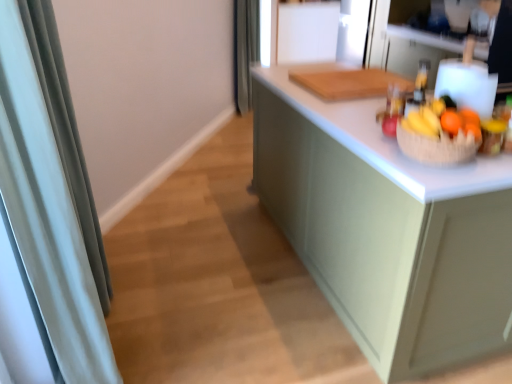
What do you see at coordinates (443, 120) in the screenshot? I see `wooden bowl of fruit at right` at bounding box center [443, 120].

How much space does gray fabric shower curtain at upper center, which is the 2th shower curtain from front to back, occupy vertically?

3.63 feet.

This screenshot has height=384, width=512. What do you see at coordinates (245, 50) in the screenshot?
I see `gray fabric shower curtain at upper center, which is the 1th shower curtain from right to left` at bounding box center [245, 50].

At what (x,y) coordinates should I click in order to perform the action: click on satin fabric shower curtain at left, placed as the 1th shower curtain when sorted from front to back. Please return your answer as a coordinate pair (x, y). Looking at the image, I should click on (46, 216).

This screenshot has width=512, height=384. What are the coordinates of `orange matte at right` in the screenshot? It's located at (451, 122).

Measure the distance between matte green cabinet at center and camera.

1.19 meters.

Where is `wooden bowl of fruit at right`? This screenshot has height=384, width=512. wooden bowl of fruit at right is located at coordinates (443, 120).

From the image's perspective, is translucent glass bottle at upper right located above or below orange matte at right?

translucent glass bottle at upper right is above orange matte at right.

Is translucent glass bottle at upper right facing away from orange matte at right?

No.

Can you confirm if translucent glass bottle at upper right is positioned to the left of orange matte at right?

No, translucent glass bottle at upper right is not to the left of orange matte at right.

Does point (240, 49) appear closer or farther from the camera than point (444, 124)?

Point (240, 49) is positioned farther from the camera compared to point (444, 124).

From the image's perspective, which is above, gray fabric shower curtain at upper center, which is the 2th shower curtain from front to back, or orange matte at right?

From the image's view, gray fabric shower curtain at upper center, which is the 2th shower curtain from front to back, is above.

From a real-world perspective, is gray fabric shower curtain at upper center, which is the 1th shower curtain from right to left, located beneath orange matte at right?

Yes, from a real-world perspective, gray fabric shower curtain at upper center, which is the 1th shower curtain from right to left, is below orange matte at right.

How far apart are satin fabric shower curtain at left, the second shower curtain positioned from the right, and matte green cabinet at center?

satin fabric shower curtain at left, the second shower curtain positioned from the right, and matte green cabinet at center are 3.42 feet apart from each other.

Which point is more forward, (76, 375) or (419, 367)?

The point (76, 375) is more forward.

Which object is closer to the camera, satin fabric shower curtain at left, placed as the second shower curtain when sorted from back to front, or matte green cabinet at center?

Positioned in front is satin fabric shower curtain at left, placed as the second shower curtain when sorted from back to front.

What's the angular difference between satin fabric shower curtain at left, which is the first shower curtain in bottom-to-top order, and matte green cabinet at center's facing directions?

The angular difference between satin fabric shower curtain at left, which is the first shower curtain in bottom-to-top order, and matte green cabinet at center is 0.504 degrees.

Based on the photo, can you confirm if brown woven basket at right is shorter than satin fabric shower curtain at left, which appears as the first shower curtain when viewed from the left?

Correct, brown woven basket at right is not as tall as satin fabric shower curtain at left, which appears as the first shower curtain when viewed from the left.

From a real-world perspective, is brown woven basket at right positioned over satin fabric shower curtain at left, the 2th shower curtain from the top, based on gravity?

Indeed, from a real-world perspective, brown woven basket at right stands above satin fabric shower curtain at left, the 2th shower curtain from the top.

Is brown woven basket at right wider or thinner than satin fabric shower curtain at left, which is the first shower curtain in bottom-to-top order?

In the image, brown woven basket at right appears to be wider than satin fabric shower curtain at left, which is the first shower curtain in bottom-to-top order.

Would you say brown woven basket at right is outside satin fabric shower curtain at left, the 2th shower curtain from the top?

Yes, brown woven basket at right is outside of satin fabric shower curtain at left, the 2th shower curtain from the top.

From the image's perspective, relative to gray fabric shower curtain at upper center, which ranks as the 1th shower curtain in back-to-front order, is wooden bowl of fruit at right above or below?

From the image's perspective, wooden bowl of fruit at right appears below gray fabric shower curtain at upper center, which ranks as the 1th shower curtain in back-to-front order.

I want to click on shower curtain above the wooden bowl of fruit at right (from the image's perspective), so click(x=245, y=50).

Visually, is wooden bowl of fruit at right positioned to the left or to the right of gray fabric shower curtain at upper center, marked as the 2th shower curtain in a left-to-right arrangement?

Clearly, wooden bowl of fruit at right is on the right of gray fabric shower curtain at upper center, marked as the 2th shower curtain in a left-to-right arrangement, in the image.

From a real-world perspective, is orange matte at right located higher than translucent glass bottle at upper right?

Incorrect, from a real-world perspective, orange matte at right is lower than translucent glass bottle at upper right.

Is orange matte at right aimed at translucent glass bottle at upper right?

No.

Which of these two, orange matte at right or translucent glass bottle at upper right, stands shorter?

With less height is orange matte at right.

Which of these two, gray fabric shower curtain at upper center, marked as the 2th shower curtain in a left-to-right arrangement, or wooden bowl of fruit at right, is bigger?

Bigger between the two is gray fabric shower curtain at upper center, marked as the 2th shower curtain in a left-to-right arrangement.

Where is `fruit in front of the gray fabric shower curtain at upper center, which is the 1th shower curtain from right to left`? Image resolution: width=512 pixels, height=384 pixels. fruit in front of the gray fabric shower curtain at upper center, which is the 1th shower curtain from right to left is located at coordinates (443, 120).

Is gray fabric shower curtain at upper center, which ranks as the 1th shower curtain in back-to-front order, to the left of wooden bowl of fruit at right from the viewer's perspective?

Indeed, gray fabric shower curtain at upper center, which ranks as the 1th shower curtain in back-to-front order, is positioned on the left side of wooden bowl of fruit at right.

This screenshot has width=512, height=384. What are the coordinates of `bottle above the orange matte at right (from a real-world perspective)` in the screenshot? It's located at (421, 81).

From a real-world perspective, starting from the orange matte at right, which shower curtain is the 2nd one below it? Please provide its 2D coordinates.

[(245, 50)]

Which object lies further to the anchor point satin fabric shower curtain at left, placed as the second shower curtain when sorted from back to front, brown woven basket at right or translucent glass bottle at upper right?

translucent glass bottle at upper right is positioned further to the anchor satin fabric shower curtain at left, placed as the second shower curtain when sorted from back to front.

Considering their positions, is orange matte at right positioned closer to gray fabric shower curtain at upper center, marked as the 2th shower curtain in a left-to-right arrangement, than translucent glass bottle at upper right?

translucent glass bottle at upper right is closer to gray fabric shower curtain at upper center, marked as the 2th shower curtain in a left-to-right arrangement.

Considering their positions, is brown woven basket at right positioned further to translucent glass bottle at upper right than satin fabric shower curtain at left, which appears as the first shower curtain when viewed from the left?

satin fabric shower curtain at left, which appears as the first shower curtain when viewed from the left, is further to translucent glass bottle at upper right.

Estimate the real-world distances between objects in this image. Which object is further from brown woven basket at right, matte green cabinet at center or translucent glass bottle at upper right?

matte green cabinet at center.

When comparing their distances from translucent glass bottle at upper right, does gray fabric shower curtain at upper center, which is the 1th shower curtain from right to left, or matte green cabinet at center seem further?

Among the two, gray fabric shower curtain at upper center, which is the 1th shower curtain from right to left, is located further to translucent glass bottle at upper right.

Based on their spatial positions, is translucent glass bottle at upper right or matte green cabinet at center closer to orange matte at right?

The object closer to orange matte at right is translucent glass bottle at upper right.

From the image, which object appears to be farther from orange matte at right, matte green cabinet at center or wooden bowl of fruit at right?

matte green cabinet at center.

When comparing their distances from translucent glass bottle at upper right, does matte green cabinet at center or orange matte at right seem closer?

orange matte at right.

This screenshot has width=512, height=384. What are the coordinates of `bottle between satin fabric shower curtain at left, placed as the 1th shower curtain when sorted from front to back, and gray fabric shower curtain at upper center, which ranks as the 1th shower curtain in back-to-front order, from front to back` in the screenshot? It's located at (421, 81).

The image size is (512, 384). In order to click on cabinetry positioned between satin fabric shower curtain at left, placed as the 1th shower curtain when sorted from front to back, and gray fabric shower curtain at upper center, marked as the second shower curtain in a bottom-to-top arrangement, from near to far in this screenshot , I will do `click(387, 229)`.

You are a GUI agent. You are given a task and a screenshot of the screen. Output one action in this format:
    pyautogui.click(x=<x>, y=<y>)
    Task: Click on the orange located between wooden bowl of fruit at right and gray fabric shower curtain at upper center, which is the 2th shower curtain from front to back, in the depth direction
    The image size is (512, 384).
    Given the screenshot: What is the action you would take?
    pyautogui.click(x=451, y=122)

Where is `bottle between wooden bowl of fruit at right and gray fabric shower curtain at upper center, which is the 2th shower curtain from front to back, along the z-axis`? This screenshot has width=512, height=384. bottle between wooden bowl of fruit at right and gray fabric shower curtain at upper center, which is the 2th shower curtain from front to back, along the z-axis is located at coordinates (421, 81).